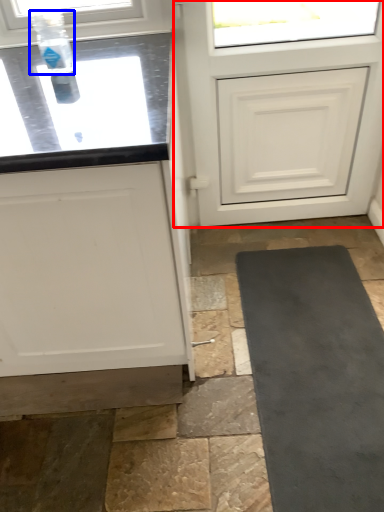
Question: Which object appears farthest to the camera in this image, door (highlighted by a red box) or bottle (highlighted by a blue box)?

Choices:
 (A) door
 (B) bottle

Answer: (A)